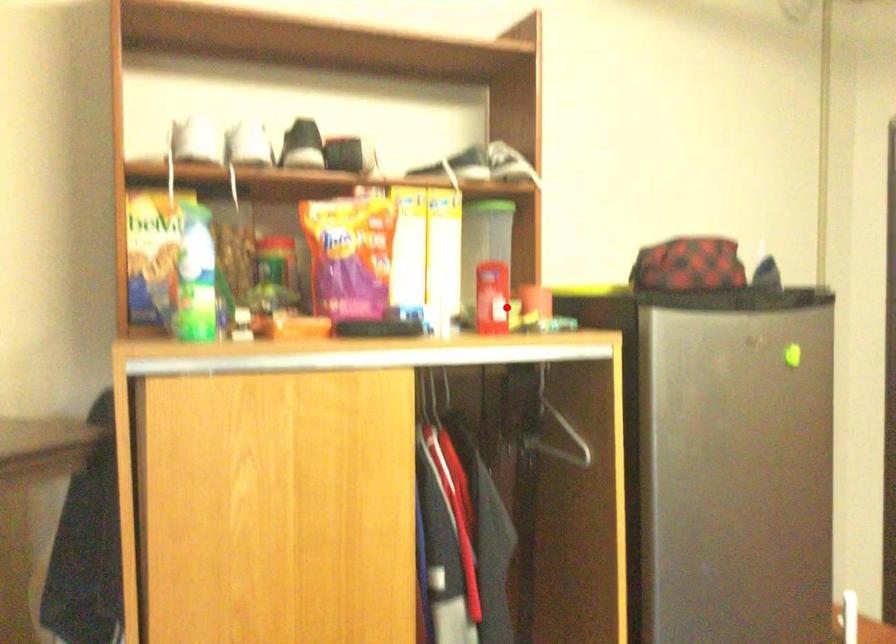
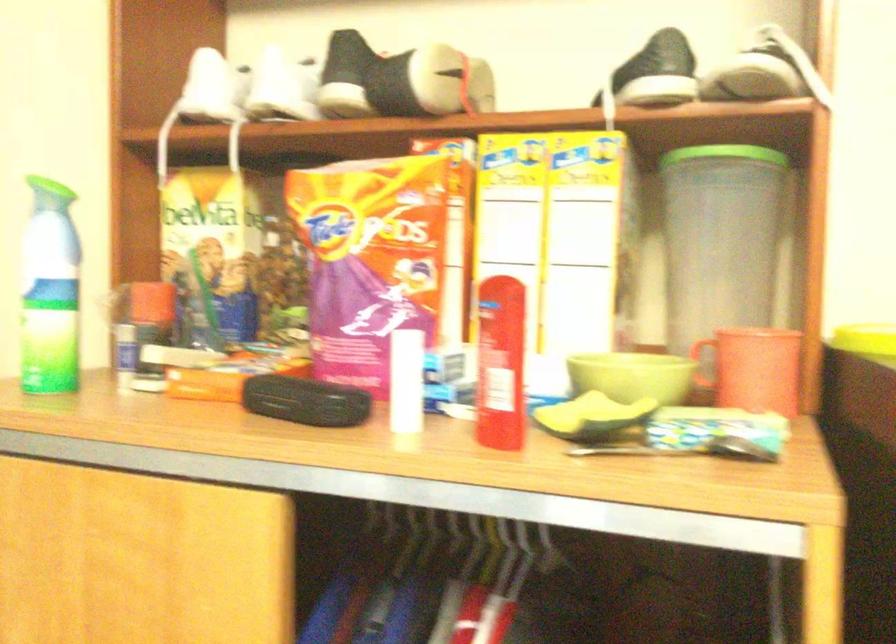
Where in the second image is the point corresponding to the highlighted location from the first image?

(633, 375)